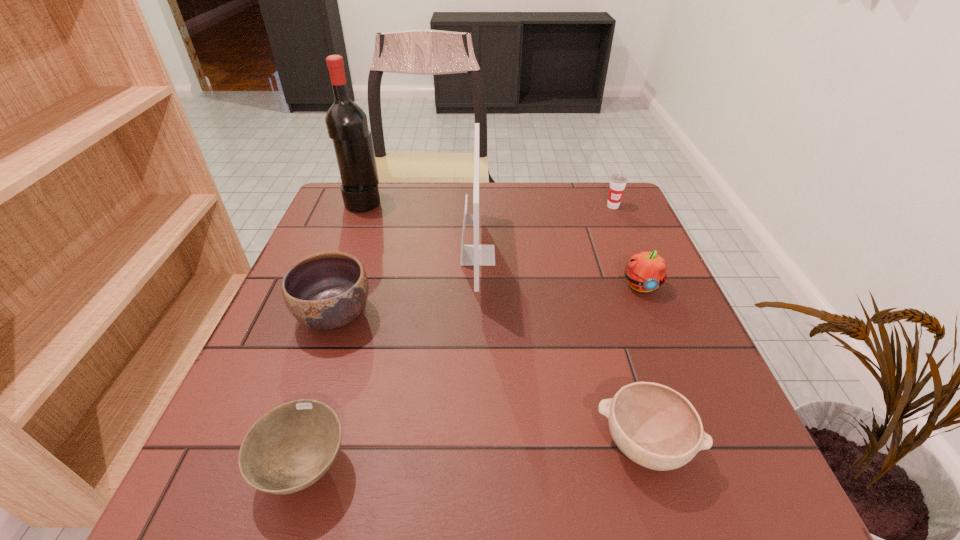
Find the location of a particular element. The height and width of the screenshot is (540, 960). empty location between the apple and the farthest bowl is located at coordinates (488, 300).

Locate an element on the screen. The image size is (960, 540). unoccupied area between the rightmost bowl and the cup is located at coordinates [x=628, y=325].

The height and width of the screenshot is (540, 960). I want to click on vacant space that is in between the tallest bowl and the monitor, so click(406, 285).

What are the coordinates of `free spot between the tallest object and the cup` in the screenshot? It's located at (489, 204).

This screenshot has width=960, height=540. I want to click on free space between the tallest object and the cup, so click(x=489, y=204).

At what (x,y) coordinates should I click in order to perform the action: click on free space between the rightmost bowl and the monitor. Please return your answer as a coordinate pair (x, y). The height and width of the screenshot is (540, 960). Looking at the image, I should click on (561, 350).

At what (x,y) coordinates should I click in order to perform the action: click on vacant space that's between the rightmost bowl and the fourth object from left to right. Please return your answer as a coordinate pair (x, y). The height and width of the screenshot is (540, 960). Looking at the image, I should click on (561, 350).

Select which object appears as the sixth closest to the tallest bowl. Please provide its 2D coordinates. Your answer should be formatted as a tuple, i.e. [(x, y)], where the tuple contains the x and y coordinates of a point satisfying the conditions above.

[(618, 182)]

The height and width of the screenshot is (540, 960). I want to click on object that stands as the closest to the rightmost bowl, so (x=645, y=271).

The width and height of the screenshot is (960, 540). In order to click on bowl object that ranks as the second closest to the rightmost bowl in this screenshot , I will do `click(328, 290)`.